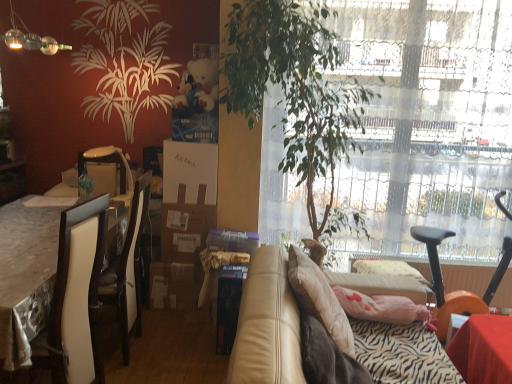
Question: Is point (209, 190) positioned closer to the camera than point (4, 225)?

Choices:
 (A) farther
 (B) closer

Answer: (A)

Question: From their relative heights in the image, would you say white cardboard box at center, the 1th box in the top-to-bottom sequence, is taller or shorter than white glossy table at left?

Choices:
 (A) short
 (B) tall

Answer: (A)

Question: Considering the real-world distances, which object is farthest from the white cardboard box at center, the 1th box from the left?

Choices:
 (A) white glossy table at left
 (B) green plastic bottle at center
 (C) green leafy plant at center
 (D) matte glass lamp at upper left
 (E) brown cardboard box at center

Answer: (D)

Question: Considering the real-world distances, which object is closest to the green leafy plant at center?

Choices:
 (A) leather couch at center
 (B) brown cardboard box at center
 (C) matte white armchair at left
 (D) transparent glass window at center
 (E) fluffy white teddy bear at upper center

Answer: (D)